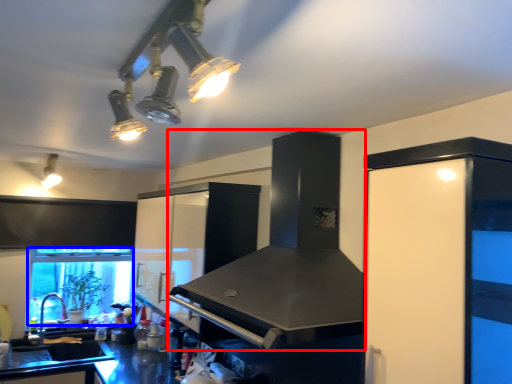
Question: Which object appears closest to the camera in this image, vent (highlighted by a red box) or window screen (highlighted by a blue box)?

Choices:
 (A) vent
 (B) window screen

Answer: (A)